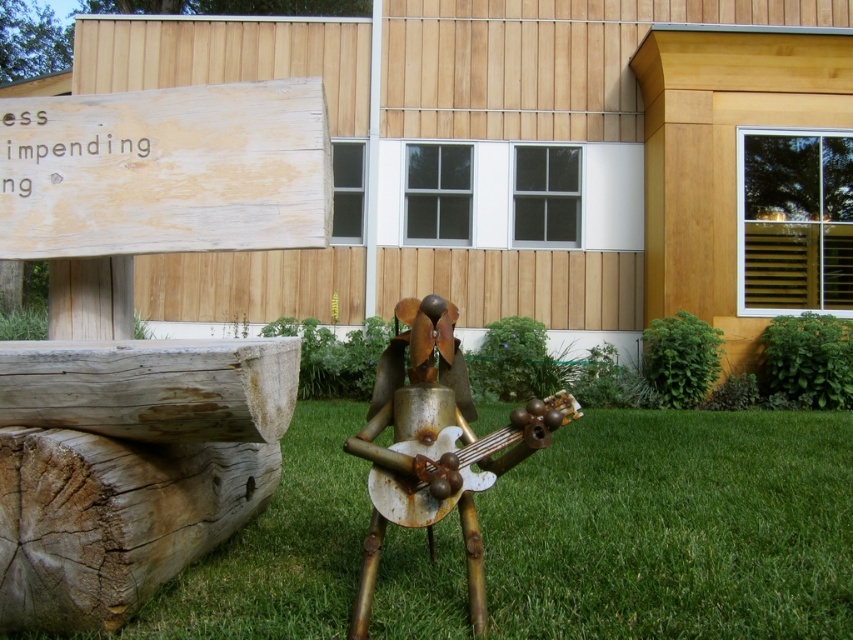
Which is in front, point (608, 502) or point (370, 449)?

Point (370, 449) is in front.

Is green grass at center to the right of rusty metal guitar at center from the viewer's perspective?

Indeed, green grass at center is positioned on the right side of rusty metal guitar at center.

Locate an element on the screen. The width and height of the screenshot is (853, 640). green grass at center is located at coordinates (675, 529).